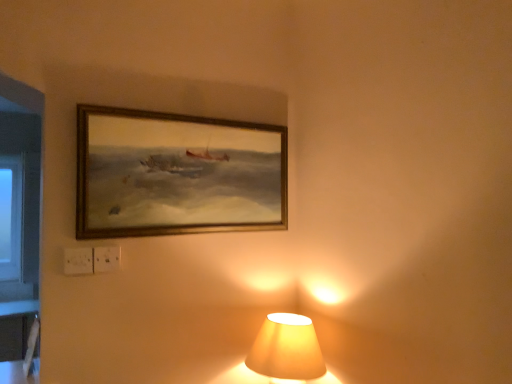
Locate an element on the screen. The image size is (512, 384). wooden frame at upper center is located at coordinates (177, 174).

The width and height of the screenshot is (512, 384). What do you see at coordinates (177, 174) in the screenshot?
I see `wooden frame at upper center` at bounding box center [177, 174].

The image size is (512, 384). I want to click on matte yellow fabric lampshade at lower center, so click(287, 349).

The height and width of the screenshot is (384, 512). What do you see at coordinates (287, 349) in the screenshot? I see `matte yellow fabric lampshade at lower center` at bounding box center [287, 349].

This screenshot has width=512, height=384. Identify the location of wooden frame at upper center. (177, 174).

Which is more to the right, wooden frame at upper center or matte yellow fabric lampshade at lower center?

matte yellow fabric lampshade at lower center is more to the right.

Is wooden frame at upper center in front of matte yellow fabric lampshade at lower center?

No.

Does point (157, 120) appear closer or farther from the camera than point (283, 350)?

Clearly, point (157, 120) is more distant from the camera than point (283, 350).

From the image's perspective, is wooden frame at upper center below matte yellow fabric lampshade at lower center?

Incorrect, from the image's perspective, wooden frame at upper center is higher than matte yellow fabric lampshade at lower center.

From a real-world perspective, relative to matte yellow fabric lampshade at lower center, is wooden frame at upper center vertically above or below?

Clearly, from a real-world perspective, wooden frame at upper center is above matte yellow fabric lampshade at lower center.

In terms of width, does wooden frame at upper center look wider or thinner when compared to matte yellow fabric lampshade at lower center?

wooden frame at upper center is thinner than matte yellow fabric lampshade at lower center.

Can you confirm if wooden frame at upper center is shorter than matte yellow fabric lampshade at lower center?

No.

Does wooden frame at upper center have a larger size compared to matte yellow fabric lampshade at lower center?

No.

Is matte yellow fabric lampshade at lower center a part of wooden frame at upper center?

No, matte yellow fabric lampshade at lower center is not a part of wooden frame at upper center.

Is wooden frame at upper center far from matte yellow fabric lampshade at lower center?

No, wooden frame at upper center is not far away from matte yellow fabric lampshade at lower center.

Is wooden frame at upper center aimed at matte yellow fabric lampshade at lower center?

No, wooden frame at upper center is not aimed at matte yellow fabric lampshade at lower center.

Locate an element on the screen. This screenshot has width=512, height=384. lamp that is on the right side of wooden frame at upper center is located at coordinates (287, 349).

Which is more to the left, matte yellow fabric lampshade at lower center or wooden frame at upper center?

wooden frame at upper center.

Consider the image. Is the position of matte yellow fabric lampshade at lower center less distant than that of wooden frame at upper center?

Yes, matte yellow fabric lampshade at lower center is closer to the camera.

Which is closer to the camera, (289, 334) or (200, 206)?

Clearly, point (289, 334) is closer to the camera than point (200, 206).

From the image's perspective, between matte yellow fabric lampshade at lower center and wooden frame at upper center, who is located below?

matte yellow fabric lampshade at lower center.

From a real-world perspective, is matte yellow fabric lampshade at lower center positioned under wooden frame at upper center based on gravity?

Indeed, from a real-world perspective, matte yellow fabric lampshade at lower center is positioned beneath wooden frame at upper center.

Does matte yellow fabric lampshade at lower center have a greater width compared to wooden frame at upper center?

Indeed, matte yellow fabric lampshade at lower center has a greater width compared to wooden frame at upper center.

Can you confirm if matte yellow fabric lampshade at lower center is taller than wooden frame at upper center?

In fact, matte yellow fabric lampshade at lower center may be shorter than wooden frame at upper center.

Between matte yellow fabric lampshade at lower center and wooden frame at upper center, which one has larger size?

matte yellow fabric lampshade at lower center is bigger.

Is matte yellow fabric lampshade at lower center located outside wooden frame at upper center?

matte yellow fabric lampshade at lower center is positioned outside wooden frame at upper center.

Is matte yellow fabric lampshade at lower center far away from wooden frame at upper center?

No, matte yellow fabric lampshade at lower center is in close proximity to wooden frame at upper center.

Is wooden frame at upper center at the back of matte yellow fabric lampshade at lower center?

No, matte yellow fabric lampshade at lower center's orientation is not away from wooden frame at upper center.

I want to click on picture frame on the left of the matte yellow fabric lampshade at lower center, so click(177, 174).

Identify the location of lamp located underneath the wooden frame at upper center (from a real-world perspective). (287, 349).

The image size is (512, 384). Find the location of `picture frame located behind the matte yellow fabric lampshade at lower center`. picture frame located behind the matte yellow fabric lampshade at lower center is located at coordinates (177, 174).